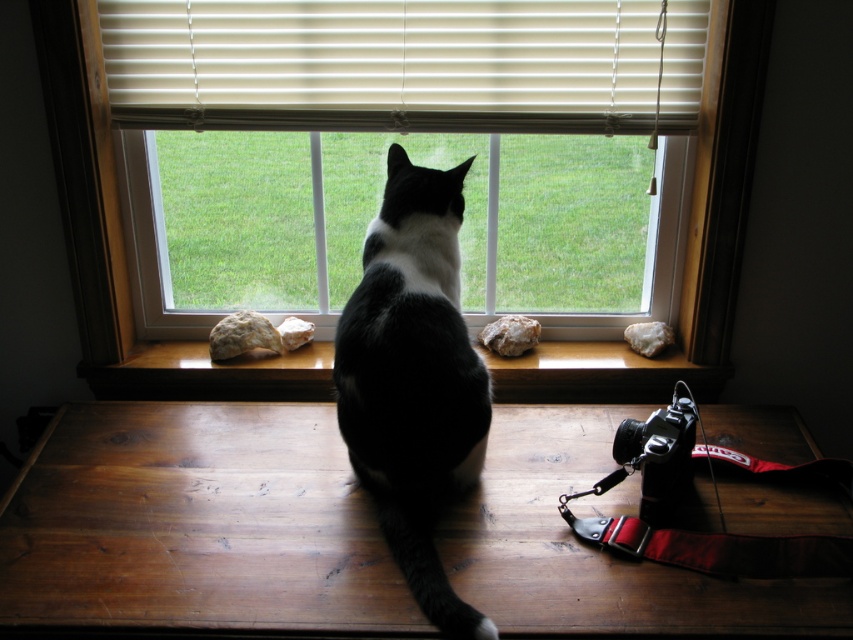
Question: In this image, where is transparent glass window at center located relative to wooden at center?

Choices:
 (A) below
 (B) above

Answer: (B)

Question: Estimate the real-world distances between objects in this image. Which object is closer to the black fur cat at center?

Choices:
 (A) transparent glass window at center
 (B) white matte blinds at upper center
 (C) wooden at center

Answer: (C)

Question: Can you confirm if white matte blinds at upper center is smaller than transparent glass window at center?

Choices:
 (A) no
 (B) yes

Answer: (B)

Question: Which object appears farthest from the camera in this image?

Choices:
 (A) transparent glass window at center
 (B) black fur cat at center
 (C) white matte blinds at upper center
 (D) wooden at center

Answer: (D)

Question: Which object is positioned farthest from the white matte blinds at upper center?

Choices:
 (A) wooden at center
 (B) transparent glass window at center
 (C) black fur cat at center

Answer: (A)

Question: Observing the image, what is the correct spatial positioning of transparent glass window at center in reference to black fur cat at center?

Choices:
 (A) above
 (B) below

Answer: (A)